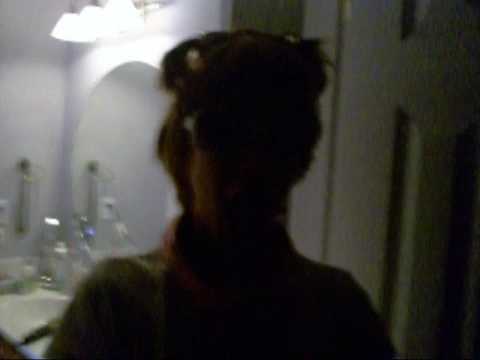
Locate an element on the screen. The width and height of the screenshot is (480, 360). lights is located at coordinates point(67,24), point(93,19), point(120,16).